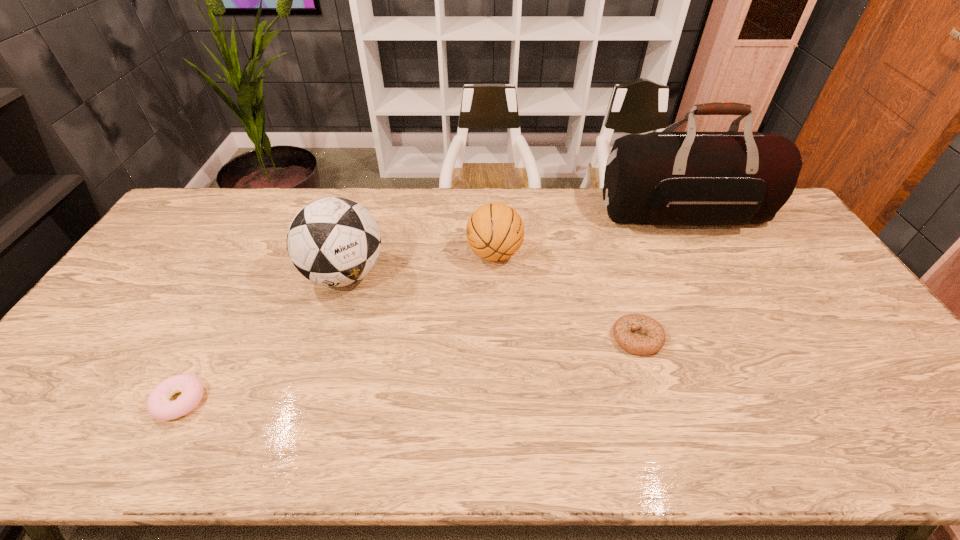
Locate an element on the screen. The width and height of the screenshot is (960, 540). vacant space that satisfies the following two spatial constraints: 1. on the surface of the bagel near the brand logo; 2. on the right side of the basketball is located at coordinates (497, 338).

Find the location of a particular element. vacant space that satisfies the following two spatial constraints: 1. on the surface of the fourth farthest object where the brand logo is visible; 2. on the right side of the fourth shortest object is located at coordinates (325, 338).

You are a GUI agent. You are given a task and a screenshot of the screen. Output one action in this format:
    pyautogui.click(x=<x>, y=<y>)
    Task: Click on the vacant region that satisfies the following two spatial constraints: 1. on the surface of the second nearest object where the brand logo is visible; 2. on the right side of the second object from left to right
    The image size is (960, 540).
    Given the screenshot: What is the action you would take?
    pyautogui.click(x=325, y=338)

Where is `free space that satisfies the following two spatial constraints: 1. on the surface of the third object from right to left near the brand logo; 2. on the left side of the fourth farthest object`? free space that satisfies the following two spatial constraints: 1. on the surface of the third object from right to left near the brand logo; 2. on the left side of the fourth farthest object is located at coordinates (497, 338).

Find the location of a particular element. Image resolution: width=960 pixels, height=540 pixels. free space that satisfies the following two spatial constraints: 1. on the surface of the third tallest object near the brand logo; 2. on the back side of the fourth farthest object is located at coordinates point(497,338).

Locate an element on the screen. The width and height of the screenshot is (960, 540). vacant space that satisfies the following two spatial constraints: 1. on the surface of the basketball near the brand logo; 2. on the right side of the bagel is located at coordinates (497, 338).